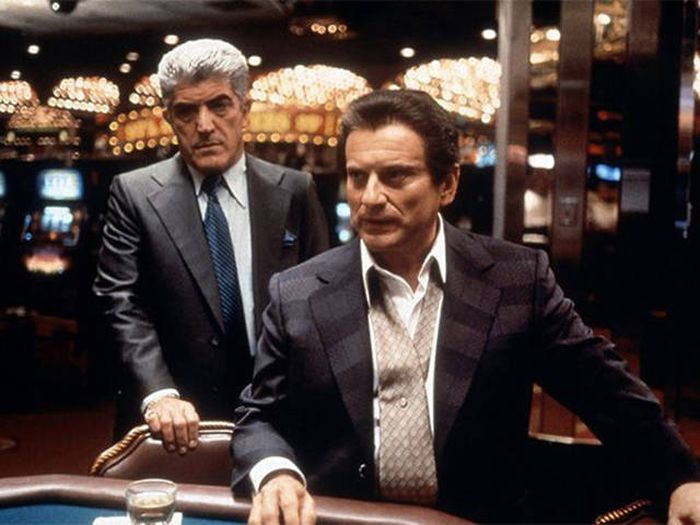
Identify the location of lights. (312, 79), (451, 81).